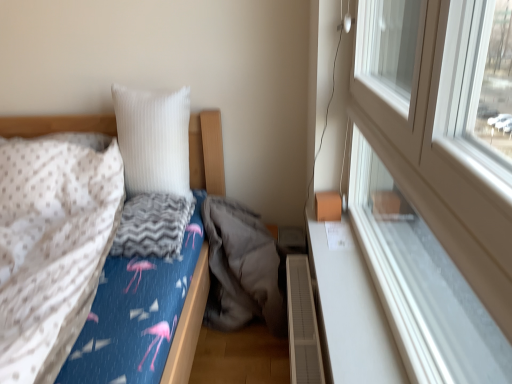
Question: Does white ribbed pillow at upper center come behind gray soft sleeping bag at center?

Choices:
 (A) no
 (B) yes

Answer: (B)

Question: Is white ribbed pillow at upper center aimed at gray soft sleeping bag at center?

Choices:
 (A) no
 (B) yes

Answer: (A)

Question: Is the surface of white ribbed pillow at upper center in direct contact with gray soft sleeping bag at center?

Choices:
 (A) no
 (B) yes

Answer: (A)

Question: Considering the relative positions of white ribbed pillow at upper center and gray soft sleeping bag at center in the image provided, is white ribbed pillow at upper center to the left of gray soft sleeping bag at center from the viewer's perspective?

Choices:
 (A) yes
 (B) no

Answer: (A)

Question: From a real-world perspective, is white ribbed pillow at upper center beneath gray soft sleeping bag at center?

Choices:
 (A) no
 (B) yes

Answer: (A)

Question: From a real-world perspective, is white ribbed pillow at upper center above or below white plastic window at upper right?

Choices:
 (A) below
 (B) above

Answer: (A)

Question: From the image's perspective, is white ribbed pillow at upper center positioned above or below white plastic window at upper right?

Choices:
 (A) below
 (B) above

Answer: (B)

Question: Considering the positions of point (181, 173) and point (478, 380), is point (181, 173) closer or farther from the camera than point (478, 380)?

Choices:
 (A) farther
 (B) closer

Answer: (A)

Question: Choose the correct answer: Is white ribbed pillow at upper center inside white plastic window at upper right or outside it?

Choices:
 (A) inside
 (B) outside

Answer: (B)

Question: In terms of height, does white ribbed pillow at upper center look taller or shorter compared to flamingo-patterned fabric bed at left?

Choices:
 (A) tall
 (B) short

Answer: (B)

Question: In the image, is white ribbed pillow at upper center on the left side or the right side of flamingo-patterned fabric bed at left?

Choices:
 (A) right
 (B) left

Answer: (A)

Question: From a real-world perspective, is white ribbed pillow at upper center physically located above or below flamingo-patterned fabric bed at left?

Choices:
 (A) above
 (B) below

Answer: (A)

Question: From the image's perspective, is white ribbed pillow at upper center located above or below flamingo-patterned fabric bed at left?

Choices:
 (A) above
 (B) below

Answer: (A)

Question: Considering the positions of white smooth window sill at right and white plastic window at upper right in the image, is white smooth window sill at right wider or thinner than white plastic window at upper right?

Choices:
 (A) wide
 (B) thin

Answer: (A)

Question: From the image's perspective, is white smooth window sill at right located above or below white plastic window at upper right?

Choices:
 (A) below
 (B) above

Answer: (A)